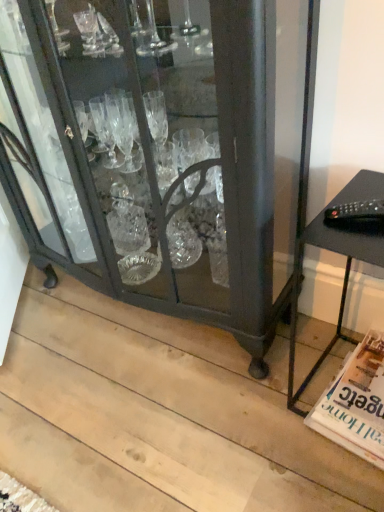
Find the location of `empty space that is in between black matte table at right and matte black cabinet at center`. empty space that is in between black matte table at right and matte black cabinet at center is located at coordinates (271, 362).